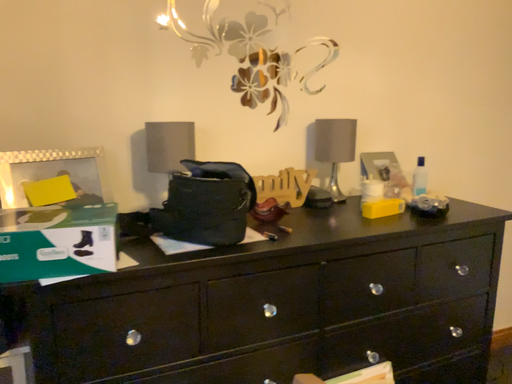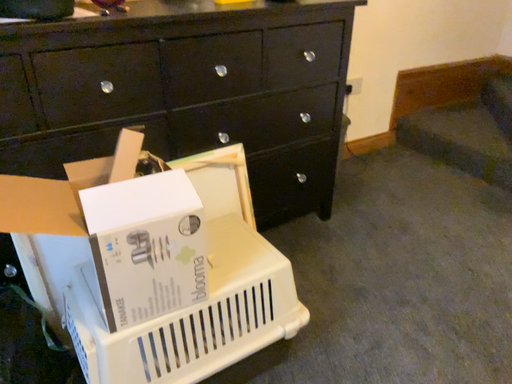
Question: How did the camera likely rotate when shooting the video?

Choices:
 (A) rotated left
 (B) rotated right

Answer: (B)